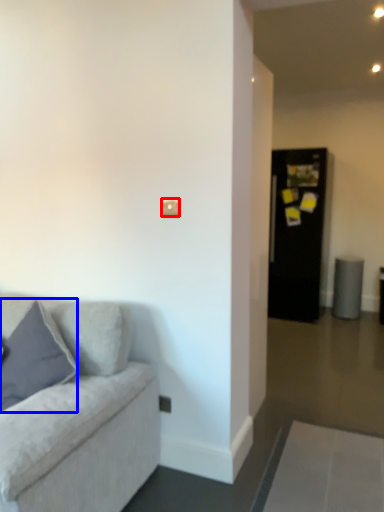
Question: Which point is closer to the camera, light switch (highlighted by a red box) or pillow (highlighted by a blue box)?

Choices:
 (A) light switch
 (B) pillow

Answer: (B)